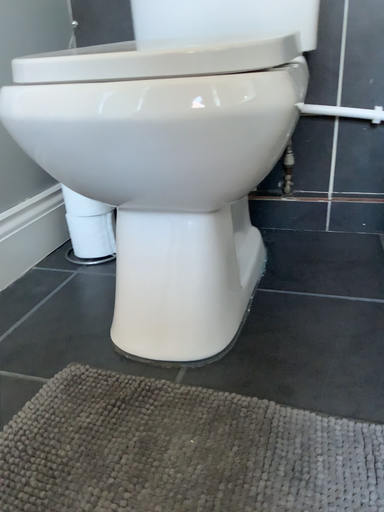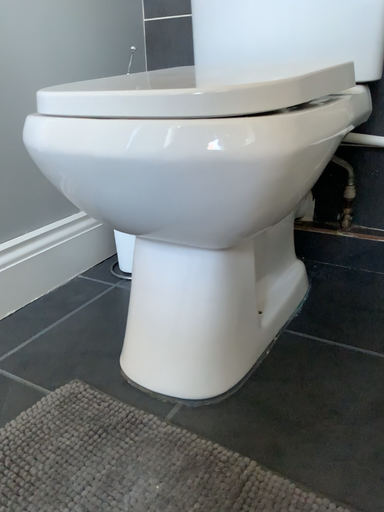
Question: Which way did the camera rotate in the video?

Choices:
 (A) rotated left
 (B) rotated right

Answer: (A)